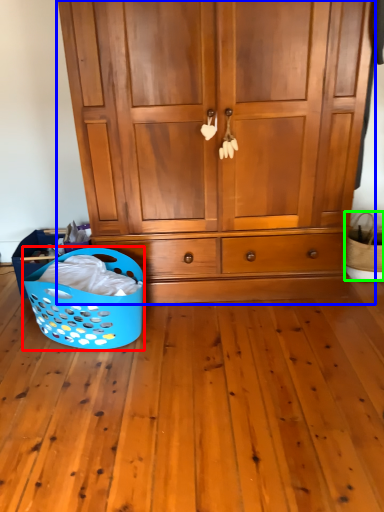
Question: Considering the real-world distances, which object is closest to basket (highlighted by a red box)? cupboard (highlighted by a blue box) or basket (highlighted by a green box).

Choices:
 (A) cupboard
 (B) basket

Answer: (A)